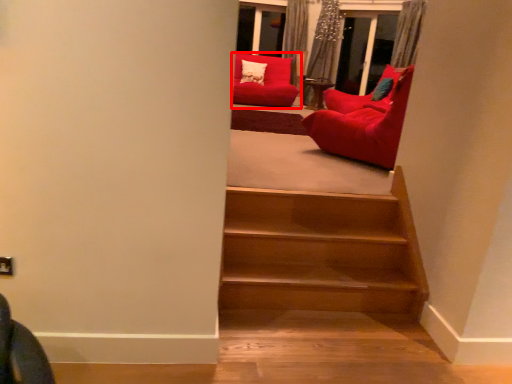
Question: From the image's perspective, considering the relative positions of chair (annotated by the red box) and chair in the image provided, where is chair (annotated by the red box) located with respect to the staircase?

Choices:
 (A) above
 (B) below

Answer: (A)